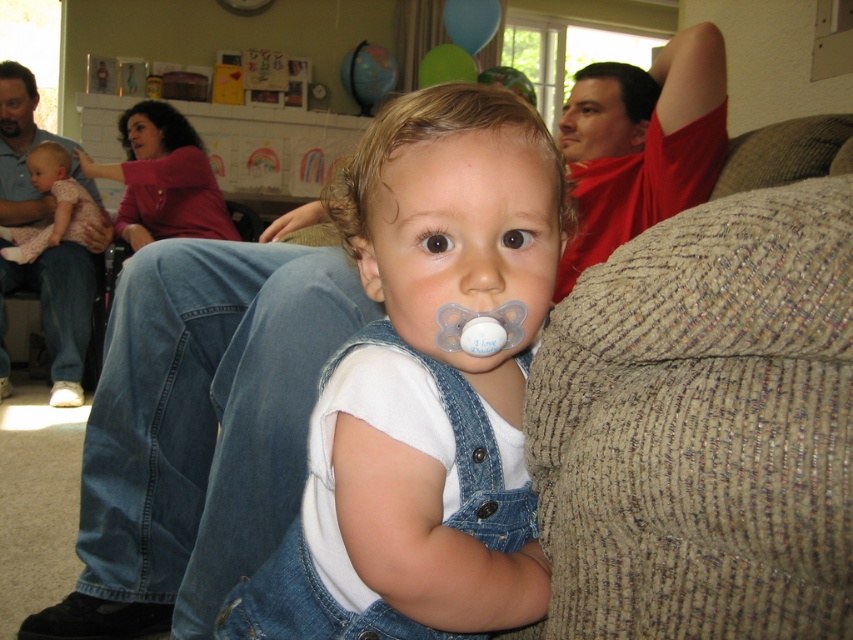
You are a photographer setting up for a family photo. You need to place a small prop between the denim overalls at center and the matte pink dress at left. Which object should the prop be closer to to ensure it fits within the space between them?

The denim overalls at center has a smaller size compared to matte pink dress at left, so the prop should be placed closer to the denim overalls at center to accommodate the space between them.

You are a photographer setting up for a family photo. The baby in denim overalls at center and the adult in matte pink dress at left are part of the shot. If your camera can focus on objects within a 8 feet range, will both subjects be in focus?

The denim overalls at center is 9.43 feet from matte pink dress at left. Since the distance between them exceeds the camera focus range of 8 feet, the camera cannot focus on both subjects simultaneously.